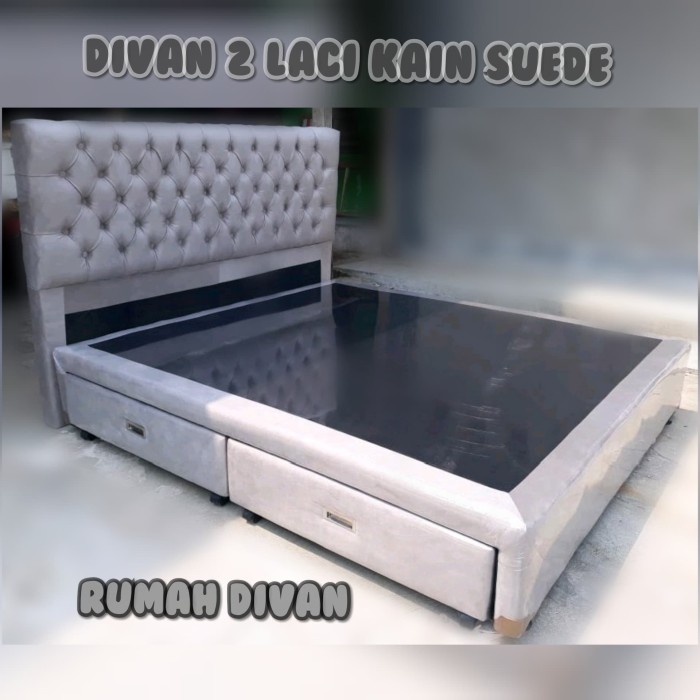
The height and width of the screenshot is (700, 700). What are the coordinates of `drawers` in the screenshot? It's located at (386, 526).